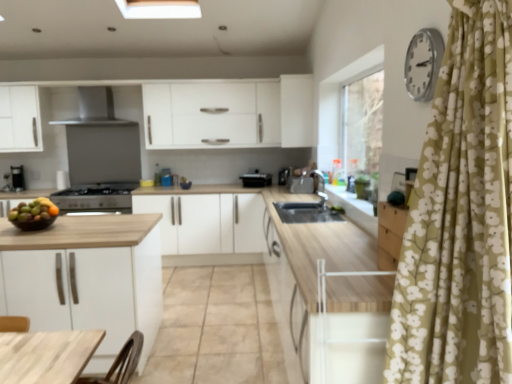
This screenshot has height=384, width=512. Identify the location of white matte cabinet at center, which is the 1th cabinetry in bottom-to-top order. pos(207,222).

Where is `wooden countertop at center`? Image resolution: width=512 pixels, height=384 pixels. wooden countertop at center is located at coordinates (87, 279).

From the picture: What is the approximate width of white matte cabinet at upper center, marked as the 2th cabinetry in a bottom-to-top arrangement?

white matte cabinet at upper center, marked as the 2th cabinetry in a bottom-to-top arrangement, is 38.50 centimeters wide.

Measure the distance between point (300, 192) and camera.

The depth of point (300, 192) is 4.69 meters.

In order to face satin silver sink at center, positioned as the 3th appliance in left-to-right order, should I rotate leftwards or rightwards?

To align with it, rotate right about 5.659°.

Identify the location of silver metallic clock at upper right. The image size is (512, 384). (423, 63).

Between point (418, 63) and point (256, 179), which one is positioned behind?

The point (256, 179) is more distant.

Which is behind, silver metallic clock at upper right or black plastic toaster at center, marked as the second appliance in a left-to-right arrangement?

black plastic toaster at center, marked as the second appliance in a left-to-right arrangement, is more distant.

Based on their sizes in the image, would you say silver metallic clock at upper right is bigger or smaller than black plastic toaster at center, marked as the 2th appliance in a right-to-left arrangement?

Clearly, silver metallic clock at upper right is smaller in size than black plastic toaster at center, marked as the 2th appliance in a right-to-left arrangement.

Is silver metallic clock at upper right next to black plastic toaster at center, marked as the second appliance in a left-to-right arrangement?

No.

Which point is more forward, (x=45, y=217) or (x=108, y=92)?

Positioned in front is point (x=45, y=217).

Would you say glossy wooden bowl of mixed fruits at left is a long distance from stainless steel range hood at upper center?

glossy wooden bowl of mixed fruits at left is far away from stainless steel range hood at upper center.

From the image's perspective, is glossy wooden bowl of mixed fruits at left on top of stainless steel range hood at upper center?

Incorrect, from the image's perspective, glossy wooden bowl of mixed fruits at left is lower than stainless steel range hood at upper center.

Is glossy wooden bowl of mixed fruits at left not inside stainless steel range hood at upper center?

That's correct, glossy wooden bowl of mixed fruits at left is outside of stainless steel range hood at upper center.

Considering the sizes of objects wooden countertop at center and silver metallic clock at upper right in the image provided, who is taller, wooden countertop at center or silver metallic clock at upper right?

Standing taller between the two is wooden countertop at center.

Which object is thinner, wooden countertop at center or silver metallic clock at upper right?

Thinner between the two is silver metallic clock at upper right.

At what (x,y) coordinates should I click in order to perform the action: click on countertop on the left of silver metallic clock at upper right. Please return your answer as a coordinate pair (x, y). The width and height of the screenshot is (512, 384). Looking at the image, I should click on (87, 279).

Is black matte gas stove at center-left, which appears as the 1th appliance when viewed from the left, at the back of glossy wooden bowl of mixed fruits at left?

Yes, glossy wooden bowl of mixed fruits at left is positioned with its back facing black matte gas stove at center-left, which appears as the 1th appliance when viewed from the left.

Considering the points (35, 218) and (131, 183), which point is behind, point (35, 218) or point (131, 183)?

The point (131, 183) is farther from the camera.

Based on their sizes in the image, would you say glossy wooden bowl of mixed fruits at left is bigger or smaller than black matte gas stove at center-left, the third appliance viewed from the right?

Clearly, glossy wooden bowl of mixed fruits at left is smaller in size than black matte gas stove at center-left, the third appliance viewed from the right.

Which object is thinner, glossy wooden bowl of mixed fruits at left or black matte gas stove at center-left, the third appliance viewed from the right?

glossy wooden bowl of mixed fruits at left is thinner.

Is wooden countertop at center placed right next to white matte cabinet at upper center, acting as the 2th cabinetry starting from the left?

No, wooden countertop at center is not in contact with white matte cabinet at upper center, acting as the 2th cabinetry starting from the left.

How different are the orientations of wooden countertop at center and white matte cabinet at upper center, which is the first cabinetry from right to left, in degrees?

90.1 degrees separate the facing orientations of wooden countertop at center and white matte cabinet at upper center, which is the first cabinetry from right to left.

Does wooden countertop at center contain white matte cabinet at upper center, which is the first cabinetry from right to left?

No, white matte cabinet at upper center, which is the first cabinetry from right to left, is not a part of wooden countertop at center.

Is black plastic toaster at center, marked as the second appliance in a left-to-right arrangement, in front of stainless steel range hood at upper center?

No, the depth of black plastic toaster at center, marked as the second appliance in a left-to-right arrangement, is greater than that of stainless steel range hood at upper center.

Which object is thinner, black plastic toaster at center, marked as the 2th appliance in a right-to-left arrangement, or stainless steel range hood at upper center?

black plastic toaster at center, marked as the 2th appliance in a right-to-left arrangement.

Is stainless steel range hood at upper center a part of black plastic toaster at center, marked as the second appliance in a left-to-right arrangement?

No, black plastic toaster at center, marked as the second appliance in a left-to-right arrangement, does not contain stainless steel range hood at upper center.

Which is nearer, (244, 174) or (106, 109)?

The point (244, 174) is more forward.

Considering the positions of point (103, 190) and point (411, 46), is point (103, 190) closer or farther from the camera than point (411, 46)?

Point (103, 190) is farther from the camera than point (411, 46).

Between black matte gas stove at center-left, the third appliance viewed from the right, and silver metallic clock at upper right, which one has more height?

With more height is silver metallic clock at upper right.

Is black matte gas stove at center-left, which appears as the 1th appliance when viewed from the left, directly adjacent to silver metallic clock at upper right?

They are not placed beside each other.

Between black matte gas stove at center-left, which appears as the 1th appliance when viewed from the left, and silver metallic clock at upper right, which one appears on the left side from the viewer's perspective?

Positioned to the left is black matte gas stove at center-left, which appears as the 1th appliance when viewed from the left.

Where is `clock on the right of black plastic toaster at center, marked as the 2th appliance in a right-to-left arrangement`? The width and height of the screenshot is (512, 384). clock on the right of black plastic toaster at center, marked as the 2th appliance in a right-to-left arrangement is located at coordinates (423, 63).

There is a glossy wooden bowl of mixed fruits at left. At what (x,y) coordinates should I click in order to perform the action: click on kitchen appliance above it (from a real-world perspective). Please return your answer as a coordinate pair (x, y). Looking at the image, I should click on (95, 108).

Considering their positions, is black matte gas stove at center-left, which appears as the 1th appliance when viewed from the left, positioned further to white matte cabinet at center, the first cabinetry when ordered from left to right, than white matte cabinet at upper center, the first cabinetry positioned from the top?

white matte cabinet at upper center, the first cabinetry positioned from the top, lies further to white matte cabinet at center, the first cabinetry when ordered from left to right, than the other object.

Which object lies nearer to the anchor point glossy wooden bowl of mixed fruits at left, black matte gas stove at center-left, which appears as the 1th appliance when viewed from the left, or stainless steel range hood at upper center?

Based on the image, black matte gas stove at center-left, which appears as the 1th appliance when viewed from the left, appears to be nearer to glossy wooden bowl of mixed fruits at left.

From the image, which object appears to be nearer to satin silver sink at center, placed as the 1th appliance when sorted from right to left, wooden countertop at center or glossy wooden bowl of mixed fruits at left?

The object closer to satin silver sink at center, placed as the 1th appliance when sorted from right to left, is wooden countertop at center.

Considering their positions, is wooden countertop at center positioned closer to black matte gas stove at center-left, the third appliance viewed from the right, than stainless steel range hood at upper center?

stainless steel range hood at upper center is closer to black matte gas stove at center-left, the third appliance viewed from the right.

From the image, which object appears to be nearer to silver metallic clock at upper right, wooden countertop at center or wooden bowl at left?

wooden countertop at center is positioned closer to the anchor silver metallic clock at upper right.

Based on their spatial positions, is glossy wooden bowl of mixed fruits at left or stainless steel range hood at upper center closer to black matte gas stove at center-left, which appears as the 1th appliance when viewed from the left?

Based on the image, glossy wooden bowl of mixed fruits at left appears to be nearer to black matte gas stove at center-left, which appears as the 1th appliance when viewed from the left.

Looking at this image, considering their positions, is wooden bowl at left positioned further to glossy wooden bowl of mixed fruits at left than white matte cabinet at center, the first cabinetry when ordered from left to right?

white matte cabinet at center, the first cabinetry when ordered from left to right, is positioned further to the anchor glossy wooden bowl of mixed fruits at left.

From the image, which object appears to be farther from black plastic toaster at center, marked as the 2th appliance in a right-to-left arrangement, satin silver sink at center, positioned as the 3th appliance in left-to-right order, or white matte cabinet at center, the first cabinetry when ordered from left to right?

The object further to black plastic toaster at center, marked as the 2th appliance in a right-to-left arrangement, is white matte cabinet at center, the first cabinetry when ordered from left to right.

This screenshot has width=512, height=384. I want to click on bowl located between stainless steel range hood at upper center and white matte cabinet at upper center, marked as the 2th cabinetry in a bottom-to-top arrangement, in the left-right direction, so click(34, 224).

Find the location of a particular element. kitchen appliance between wooden countertop at center and white matte cabinet at center, the first cabinetry when ordered from left to right, in the front-back direction is located at coordinates (95, 108).

The image size is (512, 384). In order to click on fruit between stainless steel range hood at upper center and satin silver sink at center, positioned as the 3th appliance in left-to-right order in this screenshot , I will do `click(34, 211)`.

Locate an element on the screen. bowl between wooden countertop at center and white matte cabinet at center, the first cabinetry when ordered from left to right, in the front-back direction is located at coordinates (34, 224).